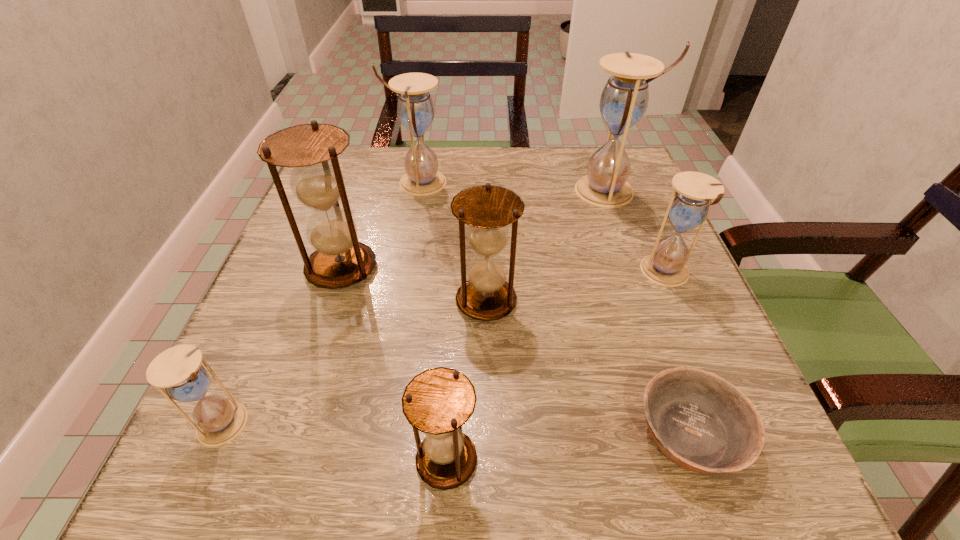
Identify the location of vacant region between the smallest brown hourglass and the leftmost brown hourglass. (394, 364).

What are the coordinates of `empty space between the biggest brown hourglass and the shortest object` in the screenshot? It's located at (516, 350).

Find the location of a particular element. This screenshot has height=540, width=960. free spot between the tallest hourglass and the bowl is located at coordinates (650, 312).

Where is `unoccupied position between the third white hourglass from right to left and the biggest white hourglass`? unoccupied position between the third white hourglass from right to left and the biggest white hourglass is located at coordinates (514, 187).

Where is `unoccupied position between the third biggest white hourglass and the second biggest white hourglass`? Image resolution: width=960 pixels, height=540 pixels. unoccupied position between the third biggest white hourglass and the second biggest white hourglass is located at coordinates (542, 228).

The width and height of the screenshot is (960, 540). What are the coordinates of `object that is the sixth closest to the leftmost brown hourglass` in the screenshot? It's located at (700, 421).

The height and width of the screenshot is (540, 960). I want to click on the second closest object to the shortest object, so click(487, 209).

Identify which hourglass is the third nearest to the smallest brown hourglass. Please provide its 2D coordinates. Your answer should be formatted as a tuple, i.e. [(x, y)], where the tuple contains the x and y coordinates of a point satisfying the conditions above.

[(339, 260)]

Identify which hourglass is located as the fourth nearest to the shortest object. Please provide its 2D coordinates. Your answer should be formatted as a tuple, i.e. [(x, y)], where the tuple contains the x and y coordinates of a point satisfying the conditions above.

[(624, 100)]

Find the location of a particular element. white hourglass that stands as the fourth closest to the bowl is located at coordinates (415, 108).